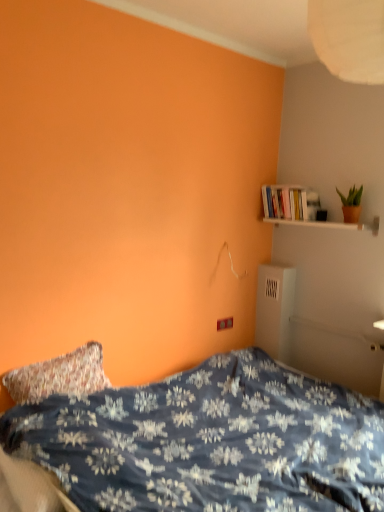
What do you see at coordinates (351, 204) in the screenshot?
I see `green matte plant at upper right` at bounding box center [351, 204].

You are a GUI agent. You are given a task and a screenshot of the screen. Output one action in this format:
    pyautogui.click(x=<x>, y=<y>)
    Task: Click on the white glossy bookshelf at upper right
    The height and width of the screenshot is (512, 384).
    Given the screenshot: What is the action you would take?
    click(x=290, y=203)

Where is `white wooden shelf at upper right`? This screenshot has height=512, width=384. white wooden shelf at upper right is located at coordinates (316, 224).

The image size is (384, 512). Describe the element at coordinates (316, 224) in the screenshot. I see `white wooden shelf at upper right` at that location.

Where is `green matte plant at upper right`? The height and width of the screenshot is (512, 384). green matte plant at upper right is located at coordinates [351, 204].

Can white glossy bookshelf at upper right be found inside white wooden shelf at upper right?

No, white wooden shelf at upper right does not contain white glossy bookshelf at upper right.

I want to click on shelf to the right of white glossy bookshelf at upper right, so click(x=316, y=224).

From their relative heights in the image, would you say white wooden shelf at upper right is taller or shorter than white glossy bookshelf at upper right?

Considering their sizes, white wooden shelf at upper right has less height than white glossy bookshelf at upper right.

How distant is blue floral fabric bed at lower left from white wooden shelf at upper right?

blue floral fabric bed at lower left and white wooden shelf at upper right are 4.92 feet apart from each other.

Can you tell me how much blue floral fabric bed at lower left and white wooden shelf at upper right differ in facing direction?

The angular difference between blue floral fabric bed at lower left and white wooden shelf at upper right is 88.8 degrees.

From a real-world perspective, is blue floral fabric bed at lower left located higher than white wooden shelf at upper right?

Incorrect, from a real-world perspective, blue floral fabric bed at lower left is lower than white wooden shelf at upper right.

Considering the sizes of blue floral fabric bed at lower left and white wooden shelf at upper right in the image, is blue floral fabric bed at lower left bigger or smaller than white wooden shelf at upper right?

Considering their sizes, blue floral fabric bed at lower left takes up more space than white wooden shelf at upper right.

How different are the orientations of green matte plant at upper right and white glossy bookshelf at upper right in degrees?

There is a 1.11-degree angle between the facing directions of green matte plant at upper right and white glossy bookshelf at upper right.

In terms of width, does green matte plant at upper right look wider or thinner when compared to white glossy bookshelf at upper right?

In the image, green matte plant at upper right appears to be more narrow than white glossy bookshelf at upper right.

From a real-world perspective, is green matte plant at upper right physically above white glossy bookshelf at upper right?

No.

Can we say green matte plant at upper right lies outside white glossy bookshelf at upper right?

Absolutely, green matte plant at upper right is external to white glossy bookshelf at upper right.

Is point (340, 224) positioned in front of point (165, 487)?

That is False.

Can you confirm if white wooden shelf at upper right is thinner than blue floral fabric bed at lower left?

Correct, the width of white wooden shelf at upper right is less than that of blue floral fabric bed at lower left.

Considering the sizes of white wooden shelf at upper right and blue floral fabric bed at lower left in the image, is white wooden shelf at upper right taller or shorter than blue floral fabric bed at lower left?

white wooden shelf at upper right is shorter than blue floral fabric bed at lower left.

From the image's perspective, who appears lower, white wooden shelf at upper right or blue floral fabric bed at lower left?

blue floral fabric bed at lower left is shown below in the image.

Considering the sizes of white glossy bookshelf at upper right and green matte plant at upper right in the image, is white glossy bookshelf at upper right bigger or smaller than green matte plant at upper right?

Considering their sizes, white glossy bookshelf at upper right takes up more space than green matte plant at upper right.

Considering the relative positions of white glossy bookshelf at upper right and green matte plant at upper right in the image provided, is white glossy bookshelf at upper right to the left or to the right of green matte plant at upper right?

From the image, it's evident that white glossy bookshelf at upper right is to the left of green matte plant at upper right.

In the image, there is a green matte plant at upper right. Where is `book above it (from the image's perspective)`? This screenshot has width=384, height=512. book above it (from the image's perspective) is located at coordinates (290, 203).

Measure the distance from white glossy bookshelf at upper right to green matte plant at upper right.

They are 13.25 inches apart.

Between point (279, 219) and point (359, 201), which one is positioned in front?

The point (359, 201) is closer.

How different are the orientations of white wooden shelf at upper right and green matte plant at upper right in degrees?

The angular difference between white wooden shelf at upper right and green matte plant at upper right is 0.136 degrees.

In terms of width, does white wooden shelf at upper right look wider or thinner when compared to green matte plant at upper right?

white wooden shelf at upper right is wider than green matte plant at upper right.

Would you say white wooden shelf at upper right is to the left or to the right of green matte plant at upper right in the picture?

From the image, it's evident that white wooden shelf at upper right is to the left of green matte plant at upper right.

Does point (354, 190) appear closer or farther from the camera than point (183, 476)?

Point (354, 190) is farther from the camera than point (183, 476).

What's the angular difference between green matte plant at upper right and blue floral fabric bed at lower left's facing directions?

88.7 degrees separate the facing orientations of green matte plant at upper right and blue floral fabric bed at lower left.

Considering the sizes of objects green matte plant at upper right and blue floral fabric bed at lower left in the image provided, who is smaller, green matte plant at upper right or blue floral fabric bed at lower left?

With smaller size is green matte plant at upper right.

Is green matte plant at upper right positioned with its back to blue floral fabric bed at lower left?

No, green matte plant at upper right is not facing the opposite direction of blue floral fabric bed at lower left.

Where is `shelf in front of the white glossy bookshelf at upper right`? shelf in front of the white glossy bookshelf at upper right is located at coordinates (316, 224).

Where is `shelf lying behind the blue floral fabric bed at lower left`? shelf lying behind the blue floral fabric bed at lower left is located at coordinates (316, 224).

Looking at the image, which one is located further to white wooden shelf at upper right, white glossy bookshelf at upper right or blue floral fabric bed at lower left?

blue floral fabric bed at lower left is further to white wooden shelf at upper right.

Looking at this image, which object lies nearer to the anchor point white wooden shelf at upper right, white glossy bookshelf at upper right or green matte plant at upper right?

white glossy bookshelf at upper right lies closer to white wooden shelf at upper right than the other object.

Looking at the image, which one is located further to blue floral fabric bed at lower left, white glossy bookshelf at upper right or green matte plant at upper right?

green matte plant at upper right.

Looking at the image, which one is located further to green matte plant at upper right, white wooden shelf at upper right or white glossy bookshelf at upper right?

white glossy bookshelf at upper right.

From the image, which object appears to be nearer to green matte plant at upper right, white wooden shelf at upper right or blue floral fabric bed at lower left?

white wooden shelf at upper right is positioned closer to the anchor green matte plant at upper right.

Looking at the image, which one is located closer to green matte plant at upper right, blue floral fabric bed at lower left or white wooden shelf at upper right?

Among the two, white wooden shelf at upper right is located nearer to green matte plant at upper right.

Based on their spatial positions, is blue floral fabric bed at lower left or white wooden shelf at upper right closer to white glossy bookshelf at upper right?

white wooden shelf at upper right.

Considering their positions, is white glossy bookshelf at upper right positioned closer to blue floral fabric bed at lower left than white wooden shelf at upper right?

white glossy bookshelf at upper right is positioned closer to the anchor blue floral fabric bed at lower left.

Where is `shelf between blue floral fabric bed at lower left and white glossy bookshelf at upper right along the z-axis`? The height and width of the screenshot is (512, 384). shelf between blue floral fabric bed at lower left and white glossy bookshelf at upper right along the z-axis is located at coordinates (316, 224).

Locate an element on the screen. The image size is (384, 512). houseplant between blue floral fabric bed at lower left and white glossy bookshelf at upper right in the front-back direction is located at coordinates (351, 204).

I want to click on houseplant positioned between white wooden shelf at upper right and white glossy bookshelf at upper right from near to far, so click(x=351, y=204).

Identify the location of shelf between blue floral fabric bed at lower left and green matte plant at upper right from front to back. This screenshot has width=384, height=512. (316, 224).